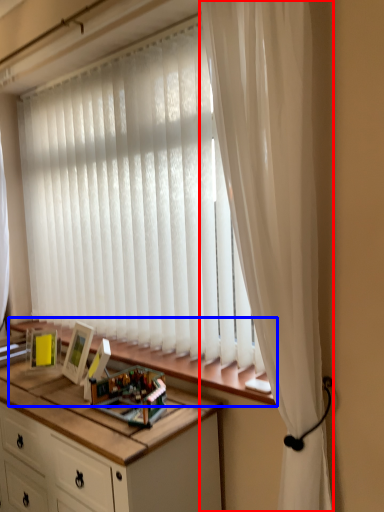
Question: Which point is further to the camera, curtain (highlighted by a red box) or window sill (highlighted by a blue box)?

Choices:
 (A) curtain
 (B) window sill

Answer: (B)